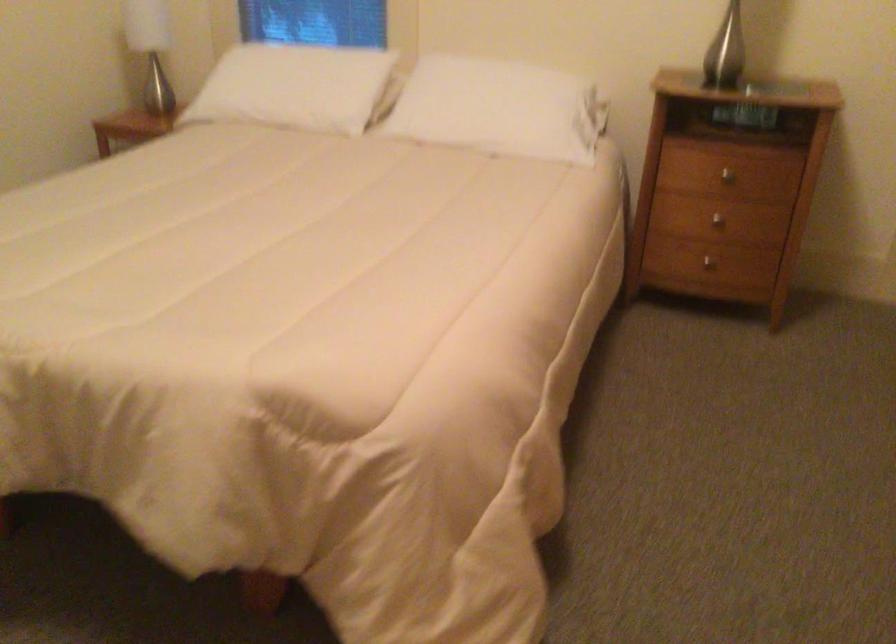
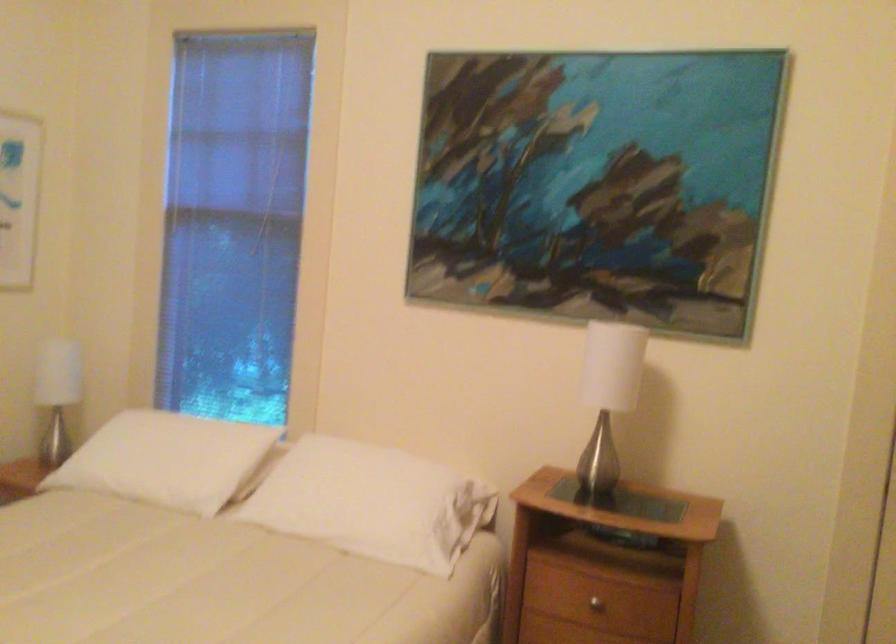
Question: The images are taken continuously from a first-person perspective. In which direction are you moving?

Choices:
 (A) Left
 (B) Right
 (C) Forward
 (D) Backward

Answer: (B)